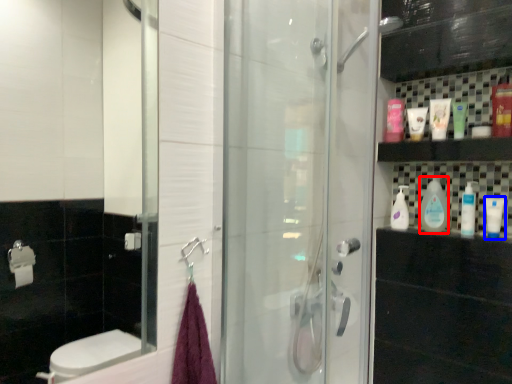
Question: Which object appears closest to the camera in this image, cleaning product (highlighted by a red box) or mouthwash (highlighted by a blue box)?

Choices:
 (A) cleaning product
 (B) mouthwash

Answer: (B)